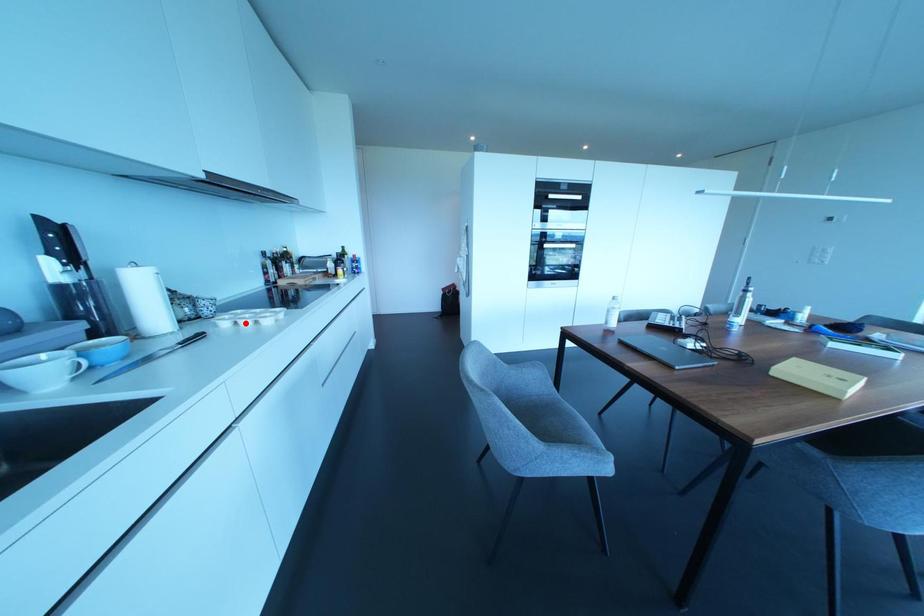
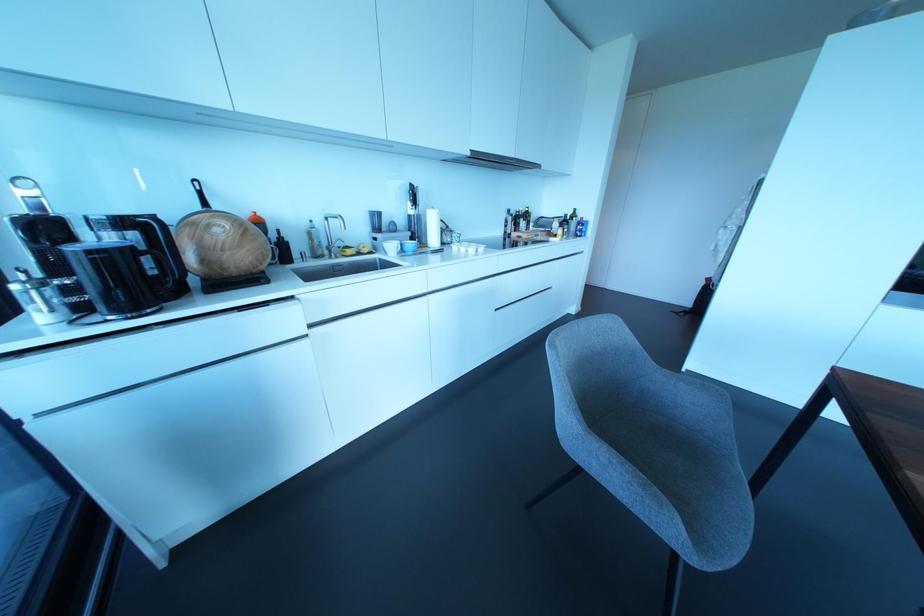
Locate, in the second image, the point that corresponds to the highlighted location in the first image.

(462, 249)